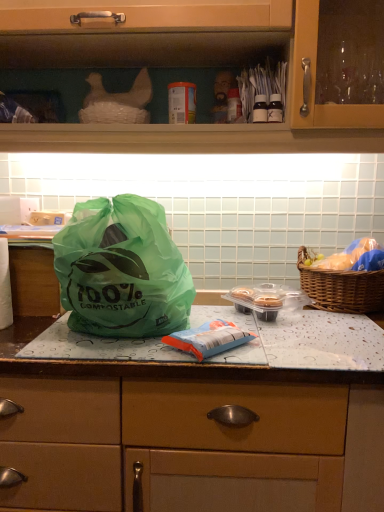
Question: From the image's perspective, is blue matte plastic bag at center, which is the second food from right to left, located above or below translucent plastic bag at right, which is counted as the second food, starting from the left?

Choices:
 (A) below
 (B) above

Answer: (A)

Question: From a real-world perspective, is blue matte plastic bag at center, arranged as the 2th food when viewed from the top, above or below translucent plastic bag at right, the second food viewed from the front?

Choices:
 (A) below
 (B) above

Answer: (A)

Question: Considering the real-world distances, which object is farthest from the white paper towel at left?

Choices:
 (A) matte wood cabinet at upper center
 (B) brown woven picnic basket at right
 (C) green plastic bag at center
 (D) translucent plastic bag at right, the first food viewed from the back
 (E) green plastic bag at center

Answer: (D)

Question: Which of these objects is positioned farthest from the green plastic bag at center?

Choices:
 (A) green plastic bag at center
 (B) translucent plastic bag at right, the first food viewed from the back
 (C) white paper towel at left
 (D) matte wood cabinet at upper center
 (E) green plastic bag at center

Answer: (D)